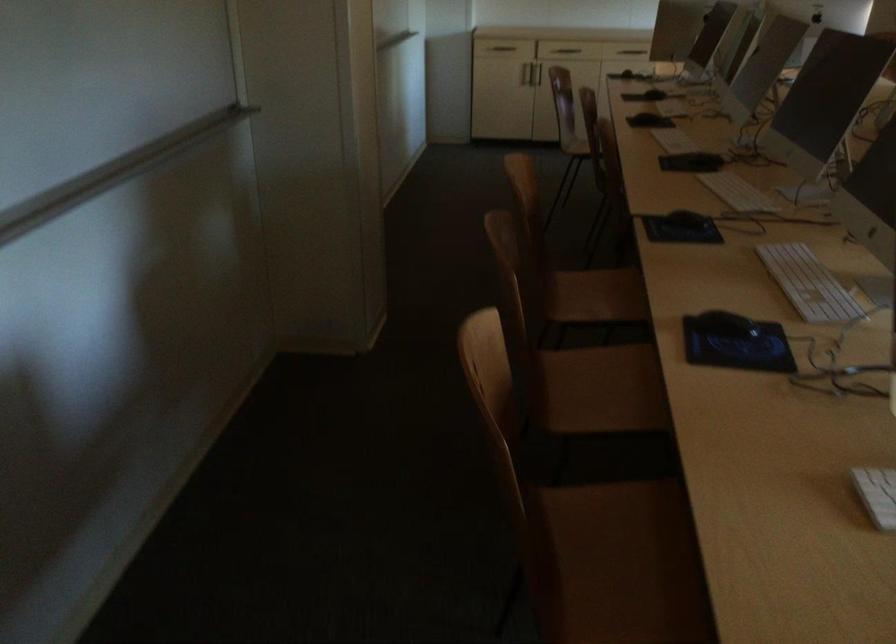
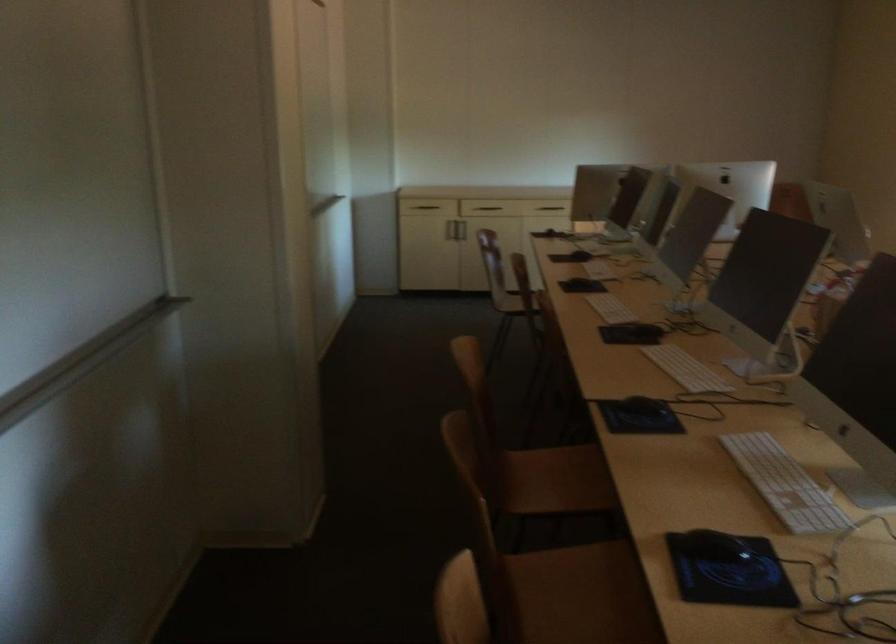
Find the pixel in the second image that matches the point at 737,190 in the first image.

(685, 368)